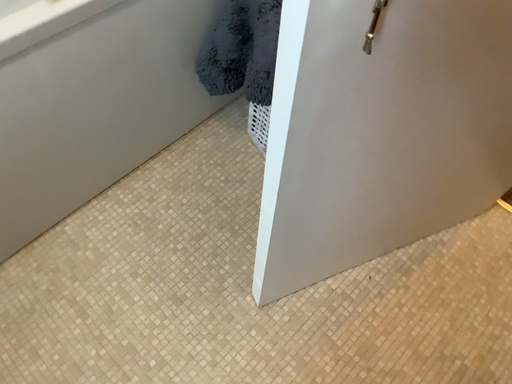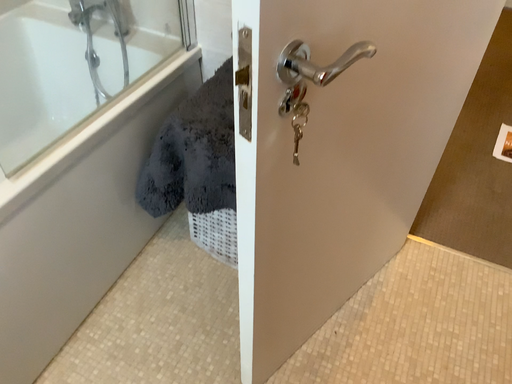
Question: Which way did the camera rotate in the video?

Choices:
 (A) rotated downward
 (B) rotated upward

Answer: (B)